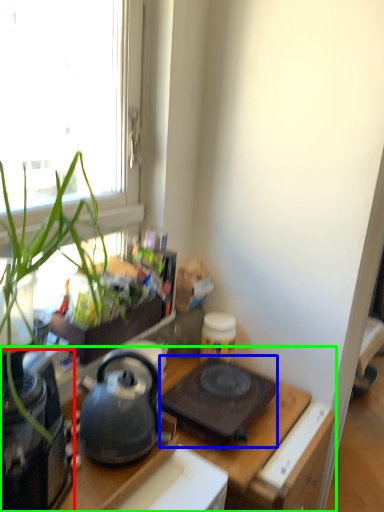
Question: Which object is positioned closest to appliance (highlighted by a red box)? Select from gas stove (highlighted by a blue box) and desk (highlighted by a green box).

Choices:
 (A) gas stove
 (B) desk

Answer: (B)